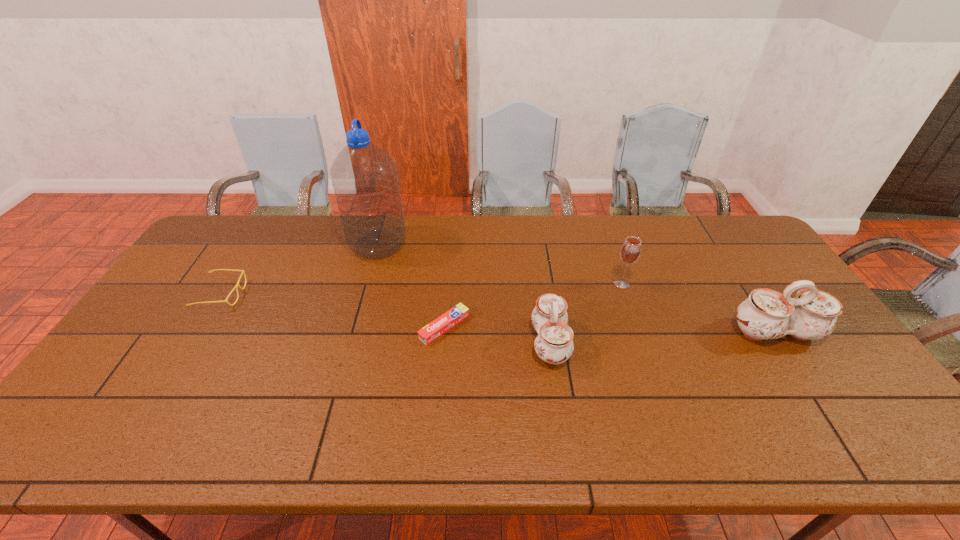
In order to click on vacant area at the far edge of the desktop in this screenshot , I will do `click(291, 256)`.

Find the location of a particular element. vacant region at the near edge is located at coordinates (727, 404).

Locate an element on the screen. Image resolution: width=960 pixels, height=540 pixels. vacant area at the left edge of the desktop is located at coordinates (180, 330).

Identify the location of free space at the right edge. This screenshot has width=960, height=540. (816, 346).

Where is `free spot between the fifth object from left to right and the toothpaste`? The image size is (960, 540). free spot between the fifth object from left to right and the toothpaste is located at coordinates (533, 305).

Where is `empty space between the spectacles and the wineglass`? Image resolution: width=960 pixels, height=540 pixels. empty space between the spectacles and the wineglass is located at coordinates (421, 289).

This screenshot has width=960, height=540. Find the location of `unoccupied position between the second object from right to left and the tallest object`. unoccupied position between the second object from right to left and the tallest object is located at coordinates (500, 264).

In order to click on vacant space that is in between the shorter chinaware and the wineglass in this screenshot , I will do `click(586, 313)`.

Find the location of `empty space that is in between the second shortest object and the wineglass`. empty space that is in between the second shortest object and the wineglass is located at coordinates pyautogui.click(x=421, y=289).

Where is `blank region between the wineglass and the farthest object`? This screenshot has width=960, height=540. blank region between the wineglass and the farthest object is located at coordinates (500, 264).